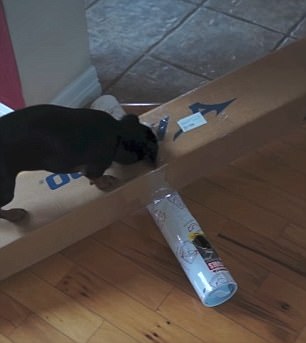
The width and height of the screenshot is (306, 343). In order to click on baseboard trim in this screenshot , I will do `click(82, 92)`.